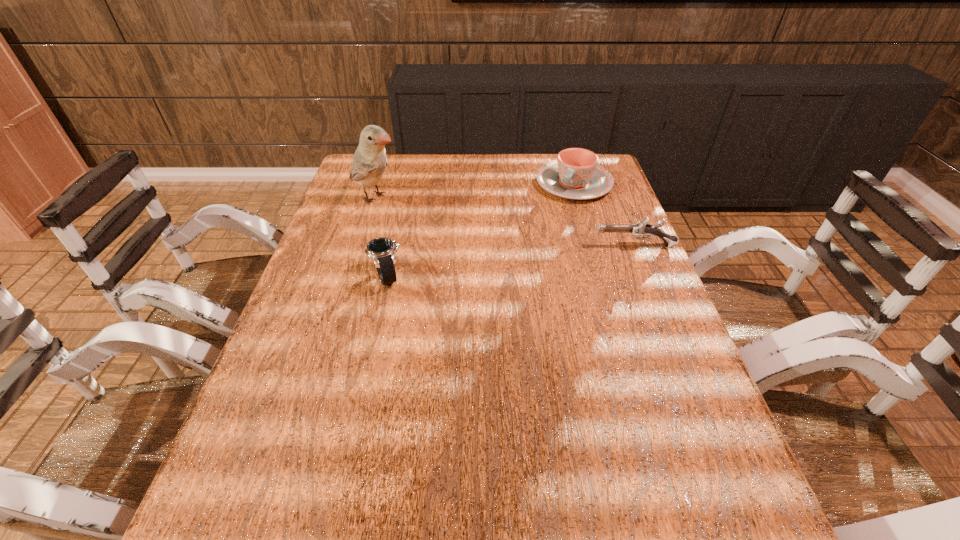
Locate an element on the screen. free spot that satisfies the following two spatial constraints: 1. on the front side of the chinaware; 2. aimed along the barrel of the gun is located at coordinates (592, 246).

This screenshot has height=540, width=960. I want to click on free location that satisfies the following two spatial constraints: 1. on the back side of the tallest object; 2. on the left side of the chinaware, so click(x=380, y=184).